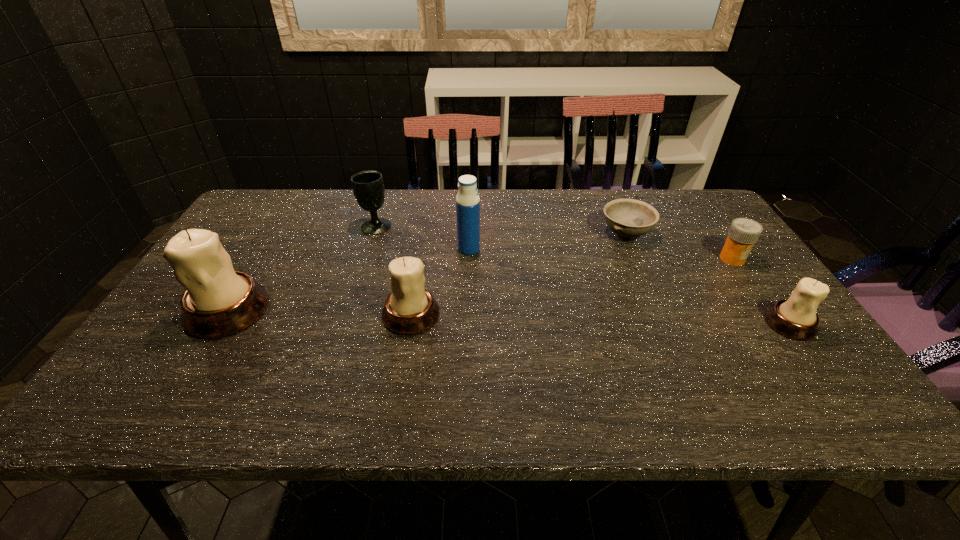
At what (x,y) coordinates should I click in order to perform the action: click on candle holder located in the right edge section of the desktop. Please return your answer as a coordinate pair (x, y). This screenshot has width=960, height=540. Looking at the image, I should click on (795, 318).

Locate an element on the screen. medicine that is at the right edge is located at coordinates (743, 233).

This screenshot has width=960, height=540. Find the location of `free region at the far edge of the desktop`. free region at the far edge of the desktop is located at coordinates (387, 201).

Find the location of a particular element. This screenshot has height=540, width=960. free space at the near edge of the desktop is located at coordinates (432, 353).

This screenshot has height=540, width=960. I want to click on free region at the right edge, so click(728, 296).

I want to click on vacant region at the far left corner, so click(x=270, y=204).

Find the location of a particular element. vacant space at the near left corner of the desktop is located at coordinates (182, 364).

I want to click on vacant space at the far right corner of the desktop, so click(671, 216).

Identify the location of vacant area that lies between the medicine and the shortest candle holder. (761, 291).

Find the location of a particular element. This screenshot has width=960, height=540. free space between the fifth tallest object and the second candle holder from right to left is located at coordinates (601, 319).